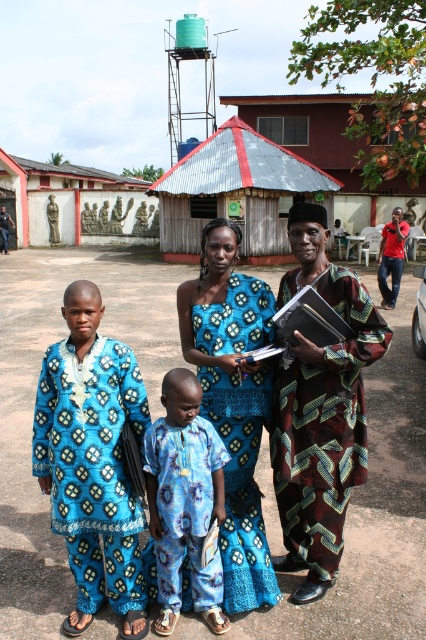
You are a photographer planning to take a group photo of the blue printed dress at center and the metallic corrugated roof at center. Which object should be closer to the camera to ensure both are in focus?

The blue printed dress at center is bigger than the metallic corrugated roof at center, so to ensure both are in focus, you should position the blue printed dress at center closer to the camera.

You are a photographer trying to capture a portrait of the blue printed dress at center and the metallic corrugated roof at center in the background. Based on their heights, which object should you focus on to ensure the dress is clearly visible in the frame?

The blue printed dress at center has a greater height compared to the metallic corrugated roof at center, so focusing on the dress will ensure it is clearly visible in the frame.